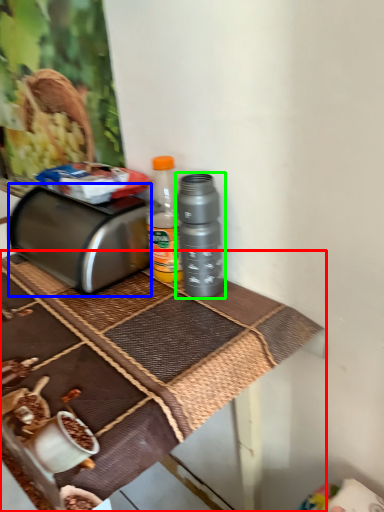
Question: Estimate the real-world distances between objects in this image. Which object is closer to table (highlighted by a red box), toaster (highlighted by a blue box) or bottle (highlighted by a green box)?

Choices:
 (A) toaster
 (B) bottle

Answer: (A)